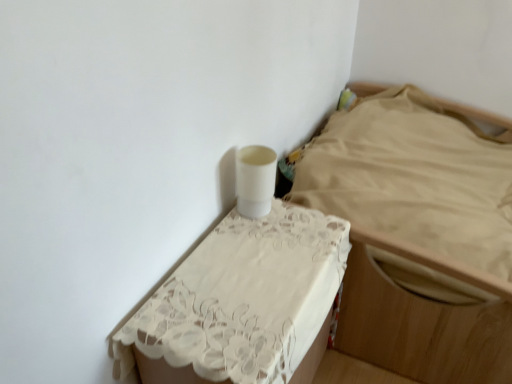
Question: Is white glossy nightstand at upper right, acting as the second furniture starting from the left, bigger or smaller than white lace tablecloth at upper center, which is counted as the 2th furniture, starting from the right?

Choices:
 (A) big
 (B) small

Answer: (A)

Question: From a real-world perspective, is white glossy nightstand at upper right, acting as the second furniture starting from the left, above or below white lace tablecloth at upper center, which is counted as the 2th furniture, starting from the right?

Choices:
 (A) below
 (B) above

Answer: (B)

Question: Considering the positions of white glossy nightstand at upper right, the first furniture viewed from the right, and white lace tablecloth at upper center, which is counted as the 2th furniture, starting from the right, in the image, is white glossy nightstand at upper right, the first furniture viewed from the right, taller or shorter than white lace tablecloth at upper center, which is counted as the 2th furniture, starting from the right,?

Choices:
 (A) tall
 (B) short

Answer: (B)

Question: From their relative heights in the image, would you say white lace tablecloth at upper center, positioned as the first furniture in left-to-right order, is taller or shorter than white glossy nightstand at upper right, acting as the second furniture starting from the left?

Choices:
 (A) short
 (B) tall

Answer: (B)

Question: From a real-world perspective, is white lace tablecloth at upper center, positioned as the first furniture in left-to-right order, positioned above or below white glossy nightstand at upper right, the first furniture viewed from the right?

Choices:
 (A) above
 (B) below

Answer: (B)

Question: In terms of width, does white lace tablecloth at upper center, positioned as the first furniture in left-to-right order, look wider or thinner when compared to white glossy nightstand at upper right, the first furniture viewed from the right?

Choices:
 (A) wide
 (B) thin

Answer: (B)

Question: Which is correct: white lace tablecloth at upper center, positioned as the first furniture in left-to-right order, is inside white glossy nightstand at upper right, the first furniture viewed from the right, or outside of it?

Choices:
 (A) inside
 (B) outside

Answer: (B)